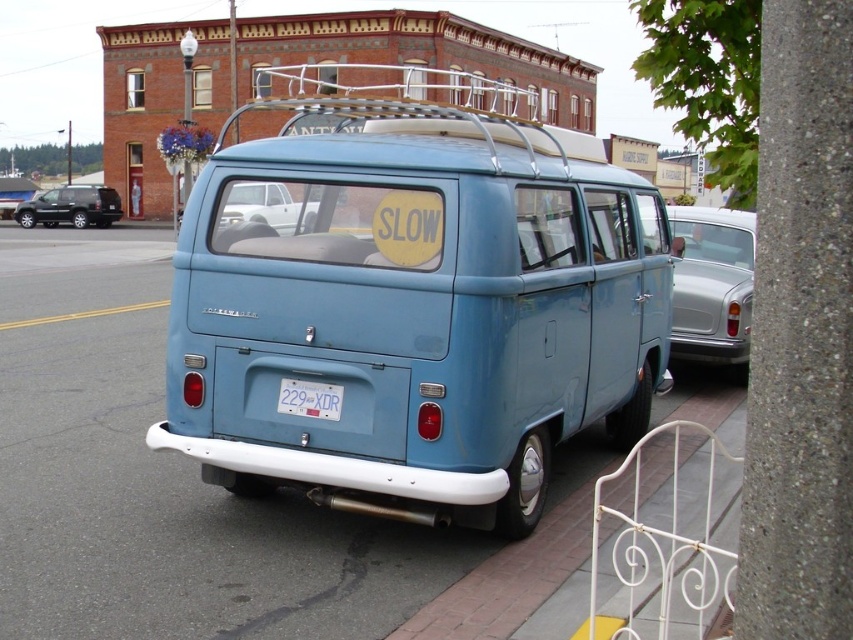
You are a pedestrian standing on the sidewalk next to the matte blue van at center. You want to read the text on the white plastic license plate at center. Can you see the license plate clearly from your current position?

The matte blue van at center is in front of the white plastic license plate at center, so the van is blocking your view of the license plate. You cannot see it clearly from your current position.

You are a delivery person trying to read the license plate of the matte blue van at center. However, you are standing on the sidewalk next to the white metal railing. Can you see the white plastic license plate at center clearly from your position?

The matte blue van at center is above the white plastic license plate at center, so the van may block your view of the license plate, making it difficult to read clearly from the sidewalk.

You are standing in front of the vintage blue Volkswagen van and want to take a photo. There are two points on the van that you need to focus on, point (706, 243) and point (289, 401). Which point should you focus on first to ensure the van is in focus?

You should focus on point (706, 243) first because it is further away from you than point (289, 401), so starting with the farther point ensures proper focus adjustment.